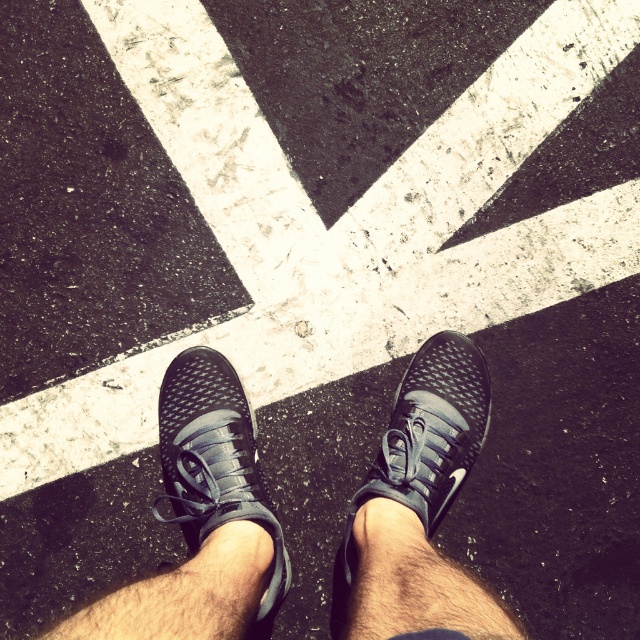
You are a pedestrian standing at the edge of the crosswalk. You want to step onto the crosswalk to reach the other side. Given the position of the black mesh sneakers at center, where should you place your foot first?

The black mesh sneakers at center are located at point (419,508). Since the crosswalk forms a plus sign, you should step onto the nearest crosswalk stripe closest to your current position to reach the black mesh sneakers at center safely.

You are a pedestrian standing at the crosswalk. You notice two matte black shoes at the center. Which one is closer to you, the matte black shoe at center or the matte black sneaker at center?

The matte black shoe at center is closer to you because it is positioned in front of the matte black sneaker at center.